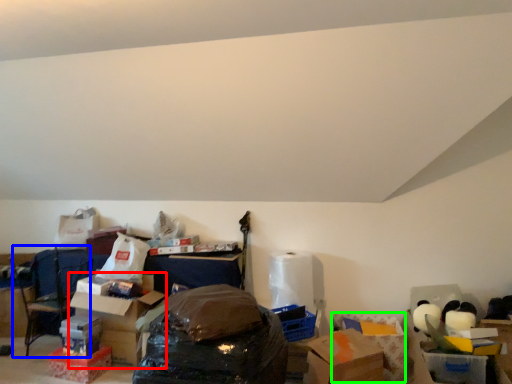
Question: Considering the real-world distances, which object is farthest from cardboard box (highlighted by a red box)? armchair (highlighted by a blue box) or cardboard box (highlighted by a green box)?

Choices:
 (A) armchair
 (B) cardboard box

Answer: (B)